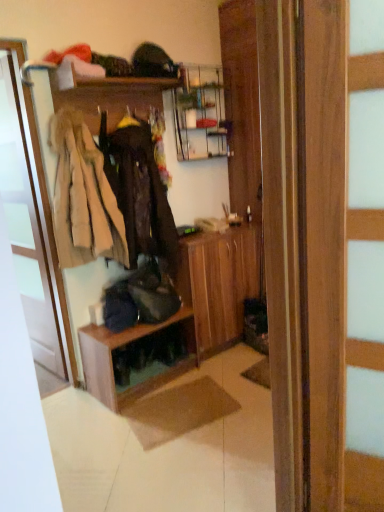
Question: Does dark brown leather jacket at center, which ranks as the 1th clothing in right-to-left order, have a greater height compared to wooden dresser at center?

Choices:
 (A) yes
 (B) no

Answer: (B)

Question: Are dark brown leather jacket at center, which ranks as the 1th clothing in right-to-left order, and wooden dresser at center far apart?

Choices:
 (A) yes
 (B) no

Answer: (B)

Question: From a real-world perspective, is dark brown leather jacket at center, the second clothing when ordered from left to right, located higher than wooden dresser at center?

Choices:
 (A) yes
 (B) no

Answer: (A)

Question: Can you confirm if dark brown leather jacket at center, which ranks as the 1th clothing in right-to-left order, is bigger than wooden dresser at center?

Choices:
 (A) yes
 (B) no

Answer: (B)

Question: From a real-world perspective, is dark brown leather jacket at center, the second clothing when ordered from left to right, below wooden dresser at center?

Choices:
 (A) yes
 (B) no

Answer: (B)

Question: Would you say wooden shelf at center, the 1th shelf positioned from the bottom, is inside or outside wooden coat rack at upper left, acting as the 2th shelf starting from the bottom?

Choices:
 (A) inside
 (B) outside

Answer: (B)

Question: Considering the positions of wooden shelf at center, the second shelf in the top-to-bottom sequence, and wooden coat rack at upper left, the 1th shelf positioned from the top, in the image, is wooden shelf at center, the second shelf in the top-to-bottom sequence, taller or shorter than wooden coat rack at upper left, the 1th shelf positioned from the top,?

Choices:
 (A) tall
 (B) short

Answer: (A)

Question: From a real-world perspective, is wooden shelf at center, the second shelf in the top-to-bottom sequence, physically located above or below wooden coat rack at upper left, acting as the 2th shelf starting from the bottom?

Choices:
 (A) above
 (B) below

Answer: (B)

Question: Would you say wooden shelf at center, the second shelf in the top-to-bottom sequence, is to the left or to the right of wooden coat rack at upper left, acting as the 2th shelf starting from the bottom, in the picture?

Choices:
 (A) right
 (B) left

Answer: (A)

Question: Does point pos(208,91) appear closer or farther from the camera than point pos(117,362)?

Choices:
 (A) closer
 (B) farther

Answer: (B)

Question: Choose the correct answer: Is wooden dresser at center inside wooden shelf at center, the 1th shelf positioned from the bottom, or outside it?

Choices:
 (A) inside
 (B) outside

Answer: (B)

Question: From a real-world perspective, relative to wooden shelf at center, the 1th shelf positioned from the bottom, is wooden dresser at center vertically above or below?

Choices:
 (A) below
 (B) above

Answer: (B)

Question: Is wooden dresser at center wider or thinner than wooden shelf at center, the 1th shelf positioned from the bottom?

Choices:
 (A) wide
 (B) thin

Answer: (B)

Question: Considering the positions of wooden dresser at center and dark brown leather jacket at center, which ranks as the 1th clothing in right-to-left order, in the image, is wooden dresser at center wider or thinner than dark brown leather jacket at center, which ranks as the 1th clothing in right-to-left order,?

Choices:
 (A) thin
 (B) wide

Answer: (A)

Question: Based on their sizes in the image, would you say wooden dresser at center is bigger or smaller than dark brown leather jacket at center, the second clothing when ordered from left to right?

Choices:
 (A) big
 (B) small

Answer: (A)